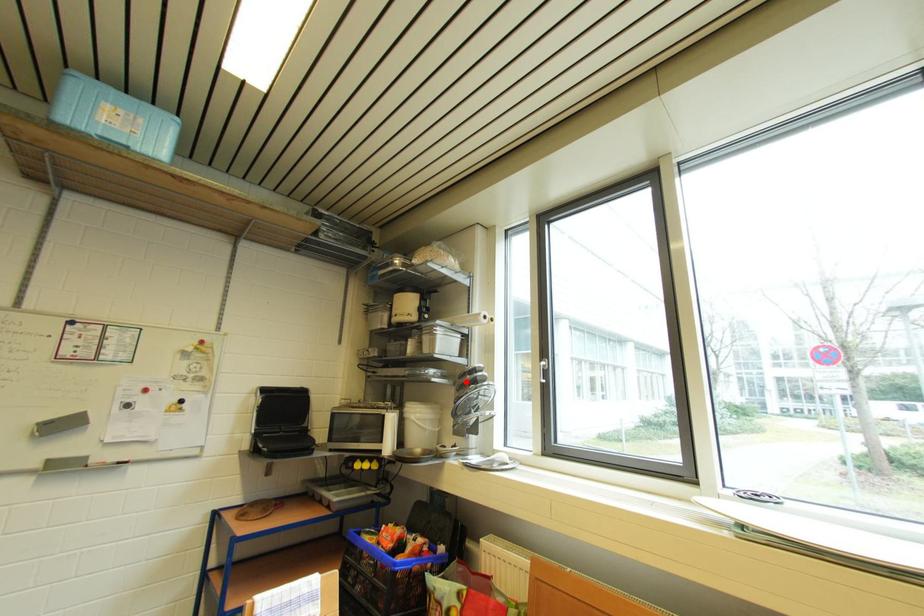
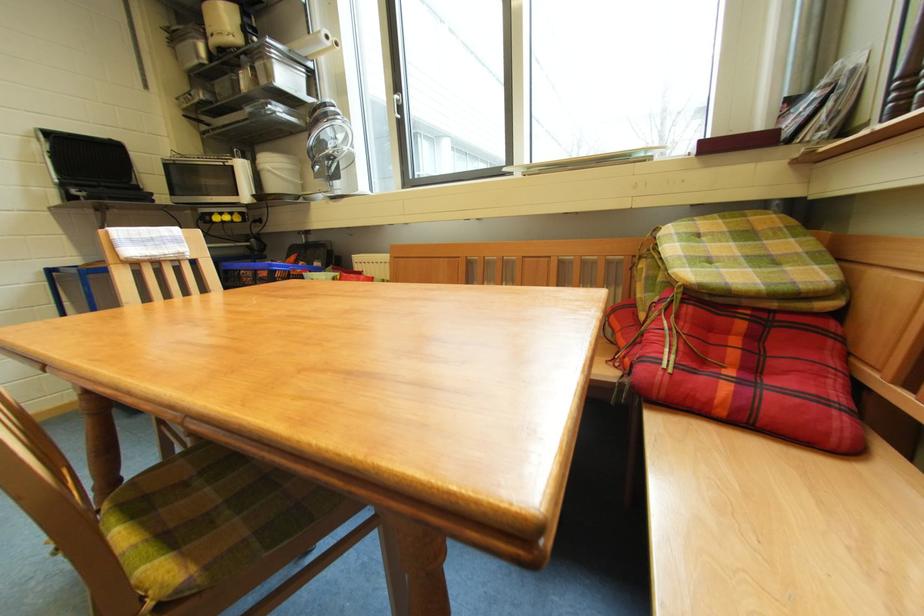
Question: A red point is marked in image1. In image2, is the corresponding 3D point closer to the camera or farther? Reply with the corresponding letter.

Choices:
 (A) The corresponding 3D point is closer.
 (B) The corresponding 3D point is farther.

Answer: (A)